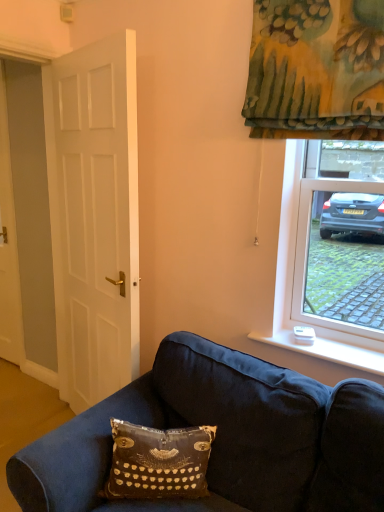
Question: Considering the relative sizes of white matte door at left, the 1th door positioned from the front, and white wood door at left, the first door when ordered from left to right, in the image provided, is white matte door at left, the 1th door positioned from the front, shorter than white wood door at left, the first door when ordered from left to right,?

Choices:
 (A) yes
 (B) no

Answer: (B)

Question: Would you say white wood door at left, the first door when ordered from left to right, is part of white matte door at left, the 1th door positioned from the front,'s contents?

Choices:
 (A) yes
 (B) no

Answer: (B)

Question: From a real-world perspective, is white matte door at left, the 2th door positioned from the left, physically below white wood door at left, the 1th door viewed from the back?

Choices:
 (A) no
 (B) yes

Answer: (A)

Question: Does white matte door at left, the 2th door positioned from the left, appear on the right side of white wood door at left, the first door when ordered from left to right?

Choices:
 (A) yes
 (B) no

Answer: (A)

Question: Can you confirm if white matte door at left, the 1th door positioned from the front, is thinner than white wood door at left, the first door when ordered from left to right?

Choices:
 (A) no
 (B) yes

Answer: (A)

Question: Does white matte door at left, the 2th door positioned from the left, have a greater height compared to white wood door at left, the second door when ordered from front to back?

Choices:
 (A) no
 (B) yes

Answer: (B)

Question: Is velvety black pillow with typewriter design at lower center at the left side of white matte door at left, the 2th door positioned from the left?

Choices:
 (A) no
 (B) yes

Answer: (A)

Question: Is velvety black pillow with typewriter design at lower center positioned in front of white matte door at left, the 2th door positioned from the left?

Choices:
 (A) no
 (B) yes

Answer: (B)

Question: Can you confirm if velvety black pillow with typewriter design at lower center is positioned to the right of white matte door at left, the 1th door positioned from the front?

Choices:
 (A) yes
 (B) no

Answer: (A)

Question: From a real-world perspective, is velvety black pillow with typewriter design at lower center under white matte door at left, positioned as the first door in right-to-left order?

Choices:
 (A) yes
 (B) no

Answer: (A)

Question: Is velvety black pillow with typewriter design at lower center facing towards white matte door at left, positioned as the first door in right-to-left order?

Choices:
 (A) no
 (B) yes

Answer: (A)

Question: Is velvety black pillow with typewriter design at lower center beside white matte door at left, the 1th door positioned from the front?

Choices:
 (A) no
 (B) yes

Answer: (A)

Question: Could white matte door at left, which appears as the 2th door when viewed from the back, be considered to be inside white wood door at left, the 1th door viewed from the back?

Choices:
 (A) yes
 (B) no

Answer: (B)